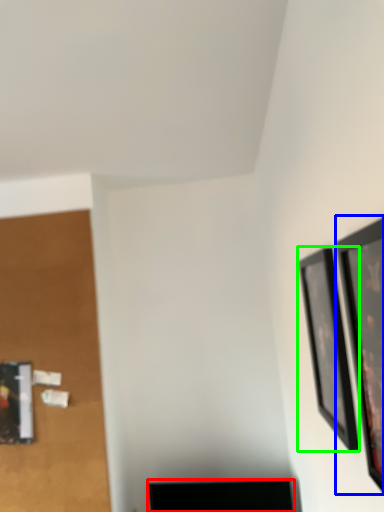
Question: Considering the real-world distances, which object is closest to furniture (highlighted by a red box)? picture frame (highlighted by a blue box) or picture frame (highlighted by a green box).

Choices:
 (A) picture frame
 (B) picture frame

Answer: (B)